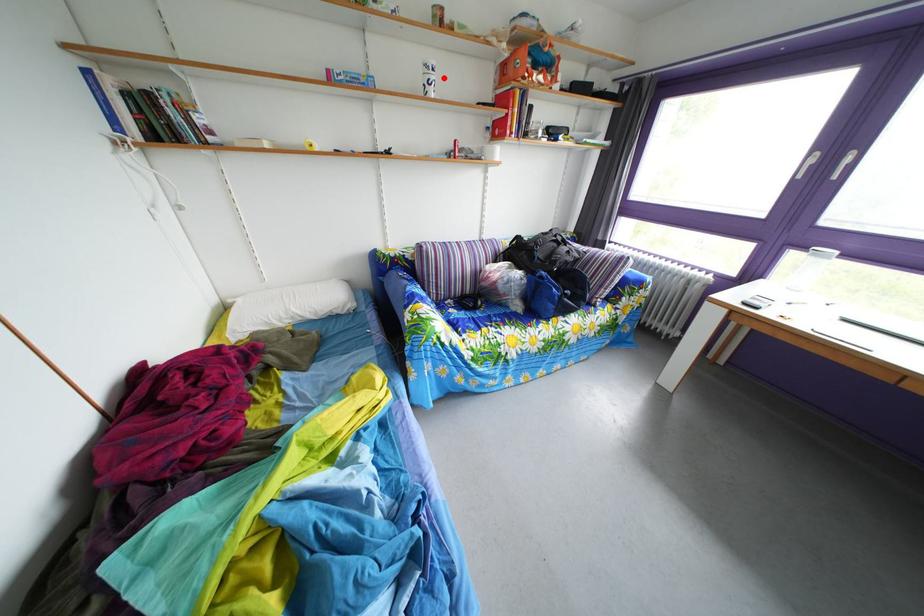
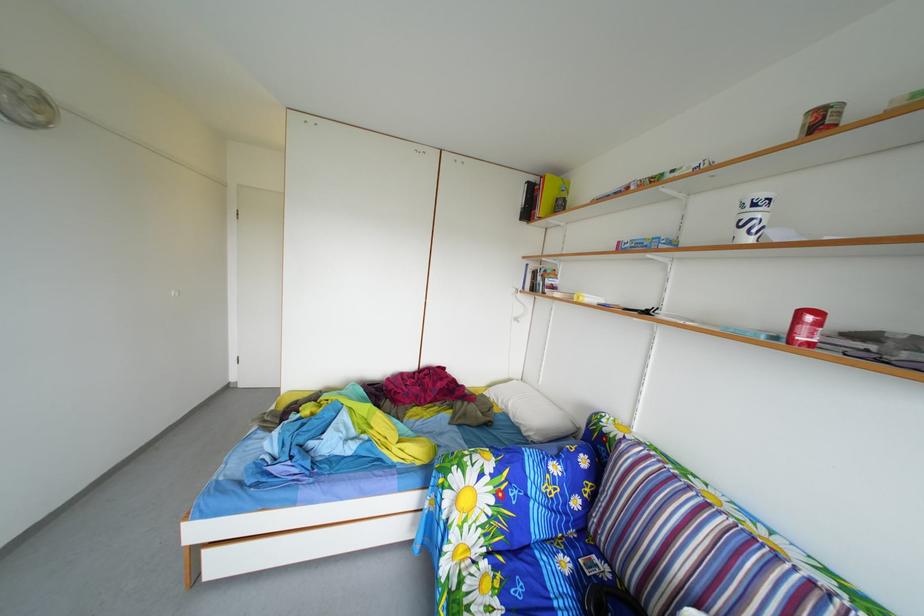
Where in the second image is the point corresponding to the highlighted location from the first image?

(766, 214)